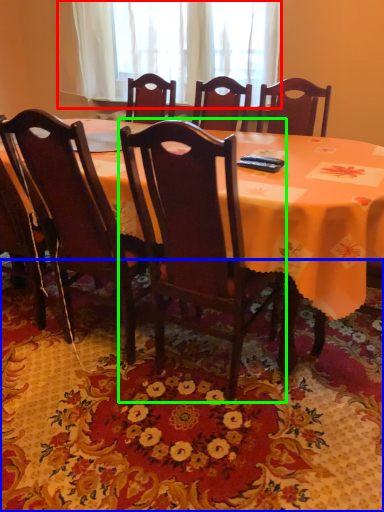
Question: Which is nearer to the curtain (highlighted by a red box)? mat (highlighted by a blue box) or chair (highlighted by a green box).

Choices:
 (A) mat
 (B) chair

Answer: (B)